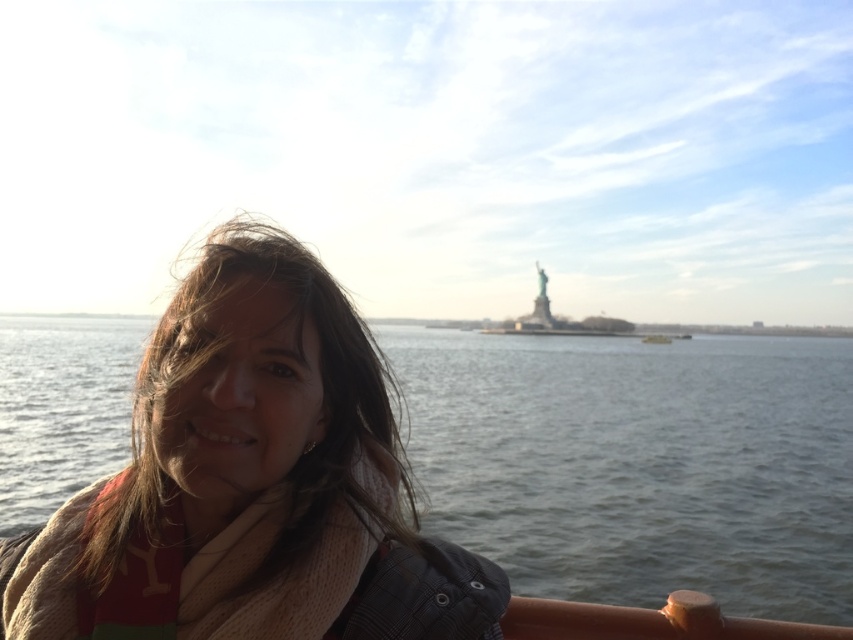
Based on the photo, you are a photographer trying to capture a photo of the Statue of Liberty with the person in the foreground. You notice the clear water at lower left and the knitted beige scarf at center. How far apart are these two elements in the scene?

The clear water at lower left is 102.13 feet away from the knitted beige scarf at center.

In the image, there is a point labeled as point (640, 464). Based on the scene description, where is this point located in relation to the Statue of Liberty?

The point (640, 464) is on clear water at lower left, which is in front of the Statue of Liberty since it is located at the lower left area of the image where the water is.